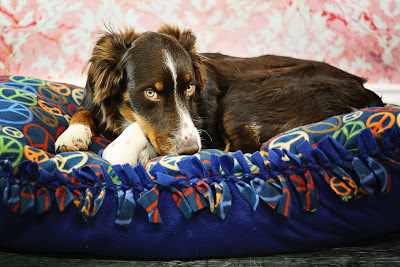
What are the coordinates of `white fur` in the screenshot? It's located at 187,124, 173,70, 130,142, 74,134, 144,154, 258,128.